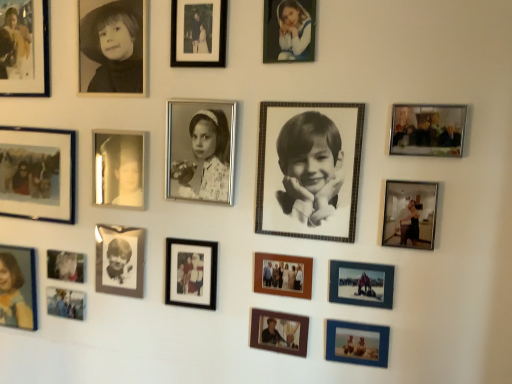
Question: Does matte blue photo frame at lower center, which is the third picture frame from right to left, have a greater width compared to matte black photo frame at center, acting as the 7th picture frame starting from the left?

Choices:
 (A) no
 (B) yes

Answer: (A)

Question: Is matte blue photo frame at lower center, the 12th picture frame from the left, in front of matte black photo frame at center, acting as the 7th picture frame starting from the left?

Choices:
 (A) yes
 (B) no

Answer: (A)

Question: Does matte blue photo frame at lower center, the 12th picture frame from the left, have a larger size compared to matte black photo frame at center, acting as the 7th picture frame starting from the left?

Choices:
 (A) no
 (B) yes

Answer: (A)

Question: Does matte blue photo frame at lower center, the 12th picture frame from the left, appear on the left side of matte black photo frame at center, acting as the 8th picture frame starting from the right?

Choices:
 (A) yes
 (B) no

Answer: (B)

Question: Does matte blue photo frame at lower center, the 12th picture frame from the left, have a lesser height compared to matte black photo frame at center, acting as the 8th picture frame starting from the right?

Choices:
 (A) no
 (B) yes

Answer: (B)

Question: Relative to metallic silver photo frame at upper right, which ranks as the first picture frame in right-to-left order, is matte wooden photo frame at left, arranged as the thirteenth picture frame when viewed from the right, in front or behind?

Choices:
 (A) front
 (B) behind

Answer: (B)

Question: From a real-world perspective, is matte wooden photo frame at left, arranged as the thirteenth picture frame when viewed from the right, above or below metallic silver photo frame at upper right, which is counted as the 14th picture frame, starting from the left?

Choices:
 (A) below
 (B) above

Answer: (A)

Question: Looking at their shapes, would you say matte wooden photo frame at left, arranged as the thirteenth picture frame when viewed from the right, is wider or thinner than metallic silver photo frame at upper right, which is counted as the 14th picture frame, starting from the left?

Choices:
 (A) thin
 (B) wide

Answer: (B)

Question: Considering the positions of point (8, 165) and point (458, 150), is point (8, 165) closer or farther from the camera than point (458, 150)?

Choices:
 (A) farther
 (B) closer

Answer: (A)

Question: Considering the positions of matte black photo frame at upper center, which ranks as the 7th picture frame in right-to-left order, and matte blue photo frame at lower center, the 12th picture frame from the left, in the image, is matte black photo frame at upper center, which ranks as the 7th picture frame in right-to-left order, wider or thinner than matte blue photo frame at lower center, the 12th picture frame from the left,?

Choices:
 (A) wide
 (B) thin

Answer: (A)

Question: From the image's perspective, is matte black photo frame at upper center, placed as the eighth picture frame when sorted from left to right, located above or below matte blue photo frame at lower center, which is the third picture frame from right to left?

Choices:
 (A) below
 (B) above

Answer: (B)

Question: Which is correct: matte black photo frame at upper center, placed as the eighth picture frame when sorted from left to right, is inside matte blue photo frame at lower center, which is the third picture frame from right to left, or outside of it?

Choices:
 (A) outside
 (B) inside

Answer: (A)

Question: Considering the positions of matte black photo frame at upper center, which ranks as the 7th picture frame in right-to-left order, and matte blue photo frame at lower center, which is the third picture frame from right to left, in the image, is matte black photo frame at upper center, which ranks as the 7th picture frame in right-to-left order, taller or shorter than matte blue photo frame at lower center, which is the third picture frame from right to left,?

Choices:
 (A) short
 (B) tall

Answer: (B)

Question: In terms of height, does wooden photo frame at center, arranged as the tenth picture frame when viewed from the left, look taller or shorter compared to metallic silver photo frame at upper right, which ranks as the first picture frame in right-to-left order?

Choices:
 (A) short
 (B) tall

Answer: (A)

Question: Based on their sizes in the image, would you say wooden photo frame at center, positioned as the 5th picture frame in right-to-left order, is bigger or smaller than metallic silver photo frame at upper right, which is counted as the 14th picture frame, starting from the left?

Choices:
 (A) small
 (B) big

Answer: (A)